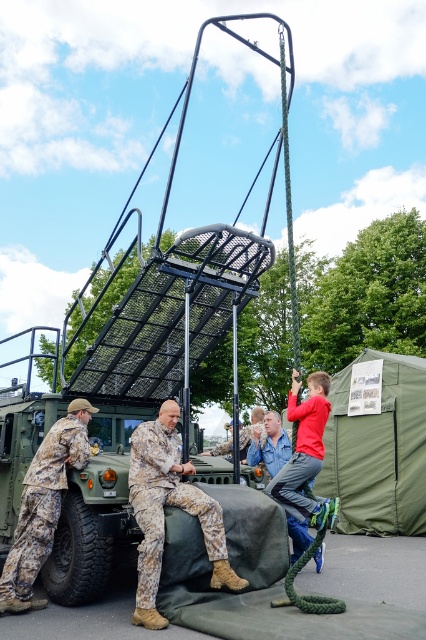
You are standing at point (215, 528) and want to move to point (350, 496). Is the path directly ahead of you clear of obstacles?

Point (350, 496) is behind point (215, 528), so the path directly ahead of you is clear of obstacles.

You are a photographer at the military event. You need to position yourself so that the camouflage fabric pants at center and the camouflage fabric soldier at lower left are both visible in your photo. Which side of the soldier should you stand to capture both objects in the frame?

You should position yourself to the right side of the camouflage fabric soldier at lower left. This way, the camouflage fabric pants at center, which is to the right of the soldier, will be visible in the frame along with the soldier.